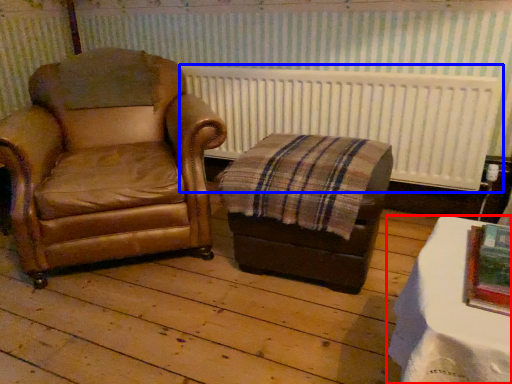
Question: Which object is closer to the camera taking this photo, table (highlighted by a red box) or radiator (highlighted by a blue box)?

Choices:
 (A) table
 (B) radiator

Answer: (A)